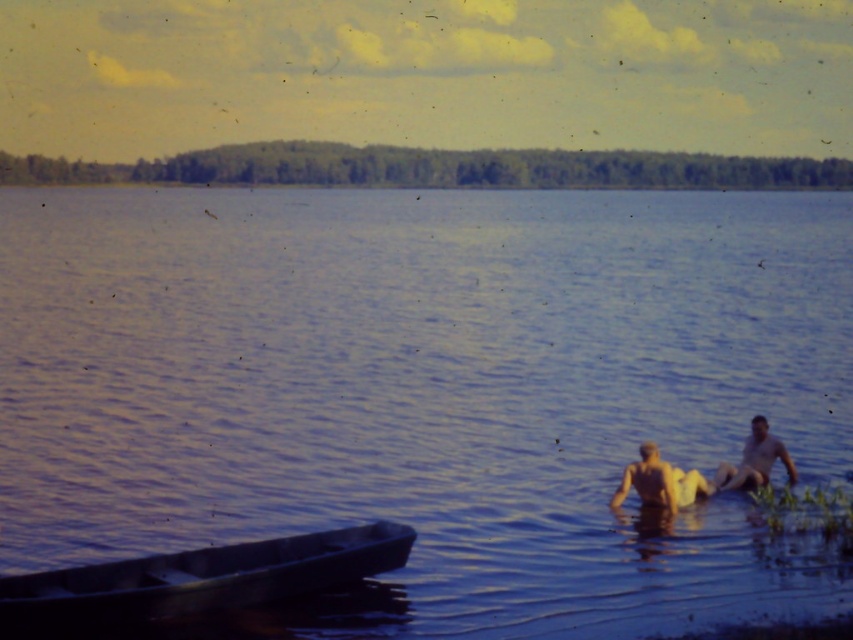
Which is behind, point (389, 417) or point (44, 634)?

Point (389, 417)

Which is above, blue water at center or dark gray metallic boat at lower left?

Positioned higher is blue water at center.

This screenshot has height=640, width=853. Find the location of `blue water at center`. blue water at center is located at coordinates [x=425, y=392].

Find the location of a particular element. Image resolution: width=853 pixels, height=640 pixels. blue water at center is located at coordinates (425, 392).

Does dark gray metallic boat at lower left have a smaller size compared to skinny yellow swimwear at lower right?

No.

Who is more forward, [146,572] or [643,458]?

Point [146,572] is more forward.

What do you see at coordinates (195, 580) in the screenshot? I see `dark gray metallic boat at lower left` at bounding box center [195, 580].

Locate an element on the screen. dark gray metallic boat at lower left is located at coordinates (195, 580).

In the scene shown: Who is more forward, [403,614] or [753,429]?

Point [403,614] is in front.

Is blue water at center to the right of smooth skin person at lower right from the viewer's perspective?

No, blue water at center is not to the right of smooth skin person at lower right.

Who is more forward, (105, 404) or (721, 470)?

Positioned in front is point (721, 470).

Locate an element on the screen. blue water at center is located at coordinates (425, 392).